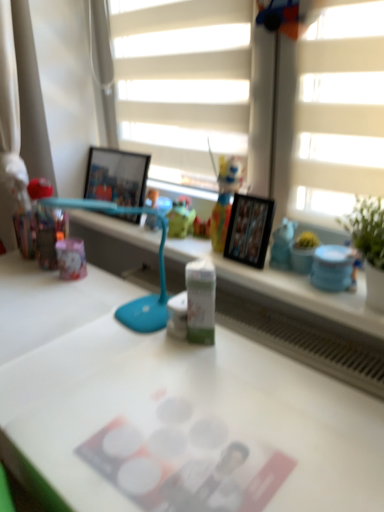
Find the location of a particular element. This screenshot has height=512, width=384. unoccupied area behind teal plastic table lamp at center is located at coordinates (104, 297).